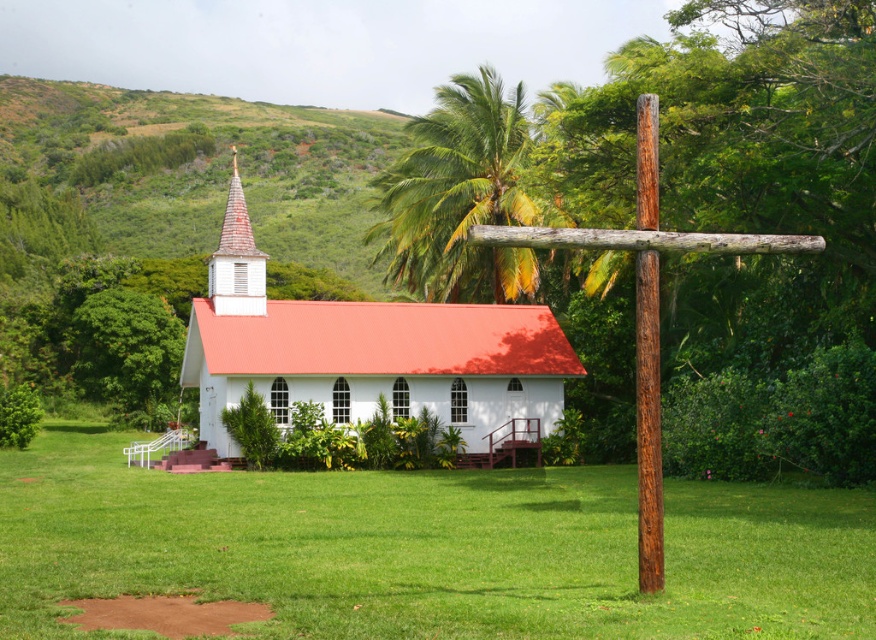
You are standing at the entrance of the small white church with a red corrugated metal roof and a steeple topped with a cross. You want to place a new flower bed exactly at the point marked as point (426, 548). Based on the scene description, where should you place the flower bed?

The green grass at center is located at point (426, 548), so you should place the flower bed there.

Based on the photo, you are a visitor standing at the entrance of the small white church with a red corrugated metal roof. You notice a green leafy palm tree at upper center and a brown wood pole at right. Which object is larger in size?

The green leafy palm tree at upper center is bigger than the brown wood pole at right according to the description.

You are standing in front of the small white church with a red corrugated metal roof. You see a brown wooden cross at right and a brown wood pole at right. Which object is positioned to the left of the other?

The brown wooden cross at right is to the left of the brown wood pole at right.